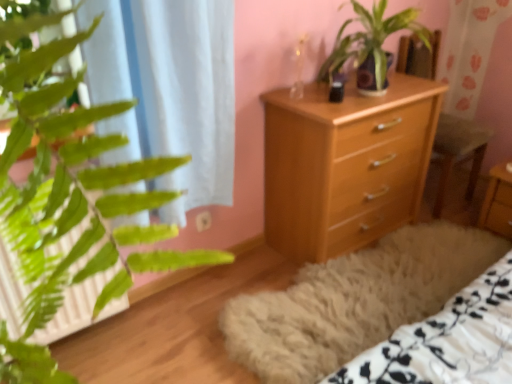
This screenshot has width=512, height=384. In order to click on vacant space to the left of wooden nightstand at center in this screenshot , I will do `click(455, 221)`.